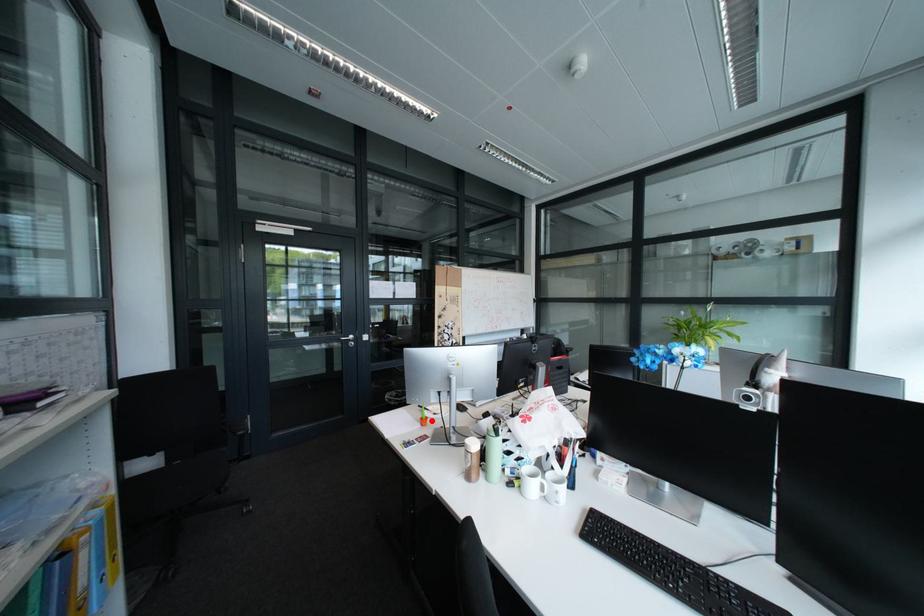
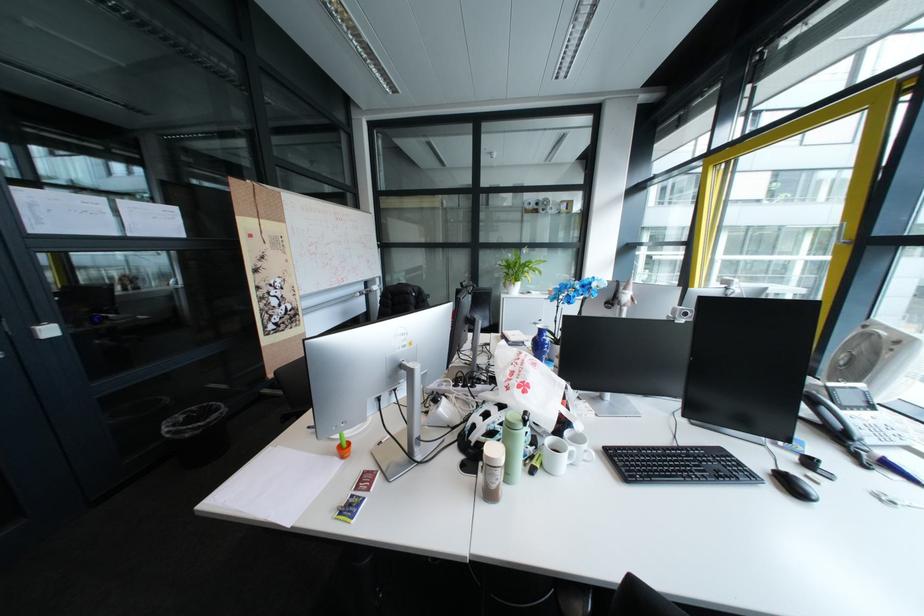
The point at the highlighted location is marked in the first image. Where is the corresponding point in the second image?

(341, 454)